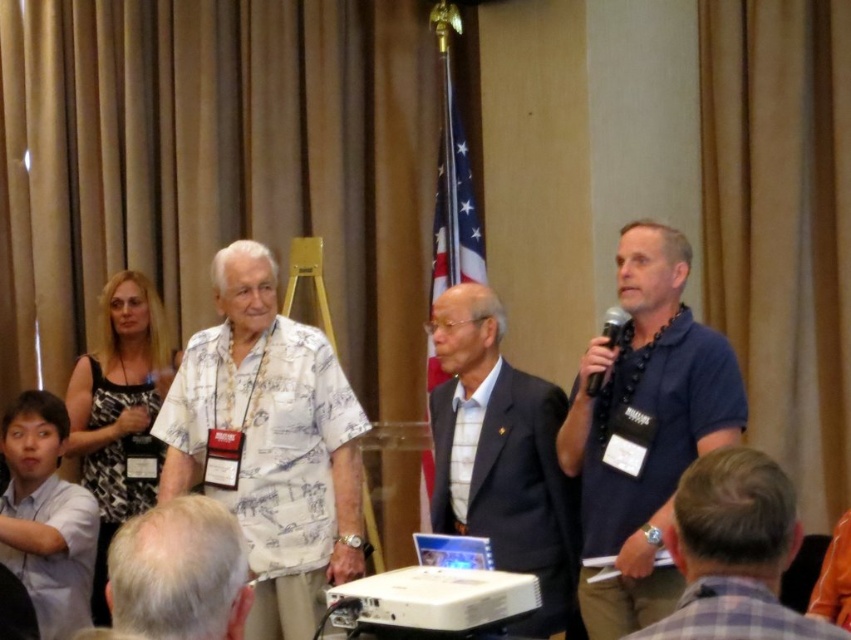
You are a photographer at the event and need to capture a photo that includes both the gray hair at center and the black metallic microphone at right. What is the minimum distance you need to move backward to ensure both are in frame?

The gray hair at center and black metallic microphone at right are 1.39 meters apart. To include both in the frame, the photographer must position themselves at least 1.39 meters away from the closest object to ensure both are visible.

You are standing at the back of the room and want to approach the two points in the image. Which point should you reach first, point (248, 456) or point (475, 316)?

You should reach point (248, 456) first because it is closer to you than point (475, 316), which is further away.

You are organizing a photo shoot and need to arrange two models in the scene based on their clothing sizes. The white printed shirt at center and the dark gray suit at center must be positioned so that the smaller one is placed in front. Which clothing item should be placed in front?

The white printed shirt at center should be placed in front because it has a smaller size compared to the dark gray suit at center.